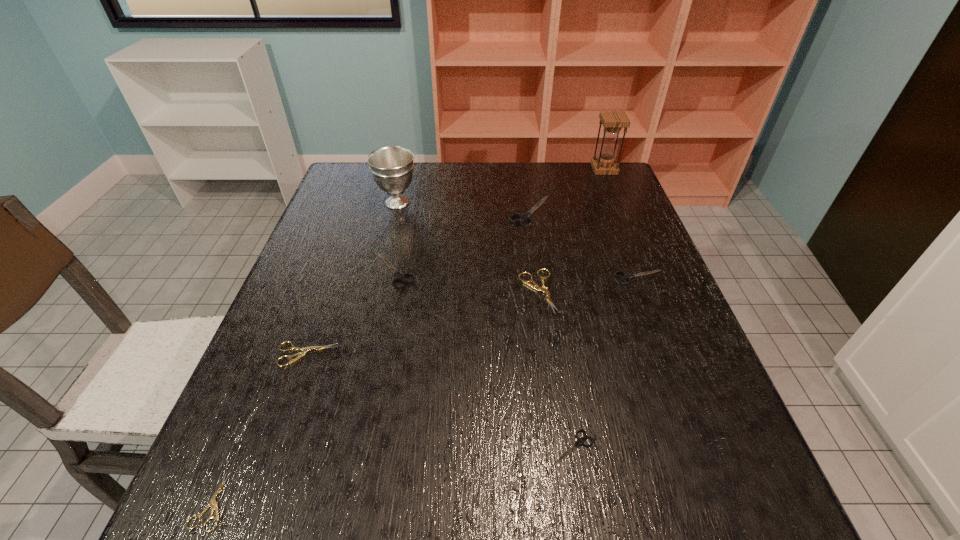
Locate an element on the screen. This screenshot has height=540, width=960. free spot between the rightmost black shears and the rightmost beige shears is located at coordinates (588, 284).

Where is `object that stands as the fifth closest to the farthest object`? The image size is (960, 540). object that stands as the fifth closest to the farthest object is located at coordinates (399, 276).

The height and width of the screenshot is (540, 960). Identify the location of object that ranks as the seventh closest to the second nearest object. (392, 167).

Find the location of a particular element. The image size is (960, 540). shears that is the second closest to the nearest beige shears is located at coordinates (399, 276).

You are a GUI agent. You are given a task and a screenshot of the screen. Output one action in this format:
    pyautogui.click(x=<x>, y=<y>)
    Task: Click on the shears that is the sixth closest to the second smallest black shears
    This screenshot has height=540, width=960.
    Given the screenshot: What is the action you would take?
    pyautogui.click(x=212, y=502)

At what (x,y) coordinates should I click in order to perform the action: click on black shears that is the nearest to the rightmost beige shears. Please return your answer as a coordinate pair (x, y). This screenshot has width=960, height=540. Looking at the image, I should click on (626, 276).

Select which black shears appears as the second closest to the chalice. Please provide its 2D coordinates. Your answer should be formatted as a tuple, i.e. [(x, y)], where the tuple contains the x and y coordinates of a point satisfying the conditions above.

[(524, 217)]

The width and height of the screenshot is (960, 540). Identify the location of the second closest beige shears relative to the tallest object. (304, 350).

You are a GUI agent. You are given a task and a screenshot of the screen. Output one action in this format:
    pyautogui.click(x=<x>, y=<y>)
    Task: Click on the beige shears that is the closest to the second nearest beige shears
    The width and height of the screenshot is (960, 540).
    Given the screenshot: What is the action you would take?
    pyautogui.click(x=212, y=502)

Locate an element on the screen. The width and height of the screenshot is (960, 540). vacant space that satisfies the following two spatial constraints: 1. on the front side of the farthest shears; 2. on the right side of the chalice is located at coordinates (396, 211).